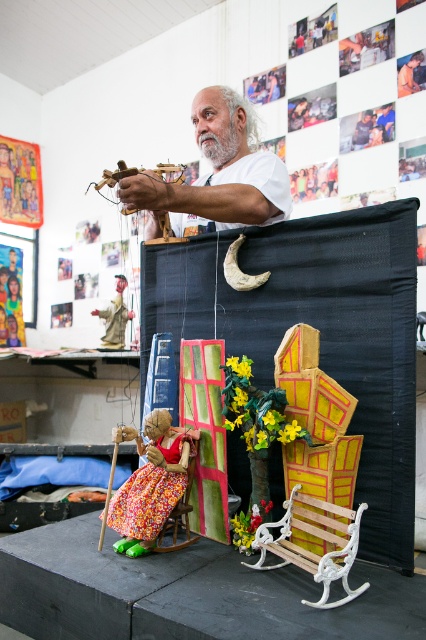
Who is more distant from viewer, (178, 189) or (118, 310)?

The point (118, 310) is more distant.

In the scene shown: Which is below, white matte man at upper center or matte brown puppet at center?

matte brown puppet at center is below.

Locate an element on the screen. The height and width of the screenshot is (640, 426). white matte man at upper center is located at coordinates (218, 172).

Is white matte man at upper center behind wooden bench at lower right?

Yes, white matte man at upper center is further from the viewer.

Who is positioned more to the right, white matte man at upper center or wooden bench at lower right?

From the viewer's perspective, wooden bench at lower right appears more on the right side.

Between point (152, 188) and point (259, 524), which one is positioned behind?

Point (152, 188)

Locate an element on the screen. white matte man at upper center is located at coordinates (218, 172).

How far apart are white matte man at upper center and floral fabric rocking chair at lower left?

They are 34.62 inches apart.

Which is behind, point (242, 209) or point (192, 541)?

The point (242, 209) is behind.

The image size is (426, 640). What are the coordinates of `white matte man at upper center` in the screenshot? It's located at (218, 172).

You are a GUI agent. You are given a task and a screenshot of the screen. Output one action in this format:
    pyautogui.click(x=<x>, y=<y>)
    Task: Click on the white matte man at upper center
    The width and height of the screenshot is (426, 640).
    Given the screenshot: What is the action you would take?
    pyautogui.click(x=218, y=172)